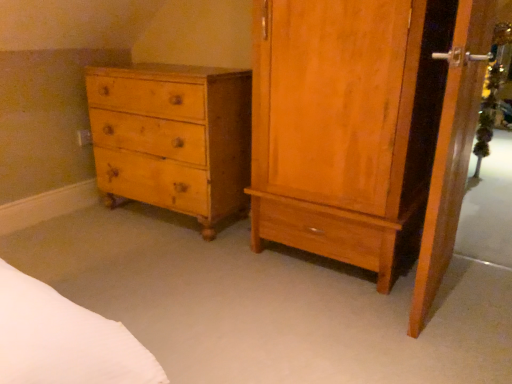
Identify the location of vacant space to the left of light brown wood cabinet at right. The image size is (512, 384). (211, 274).